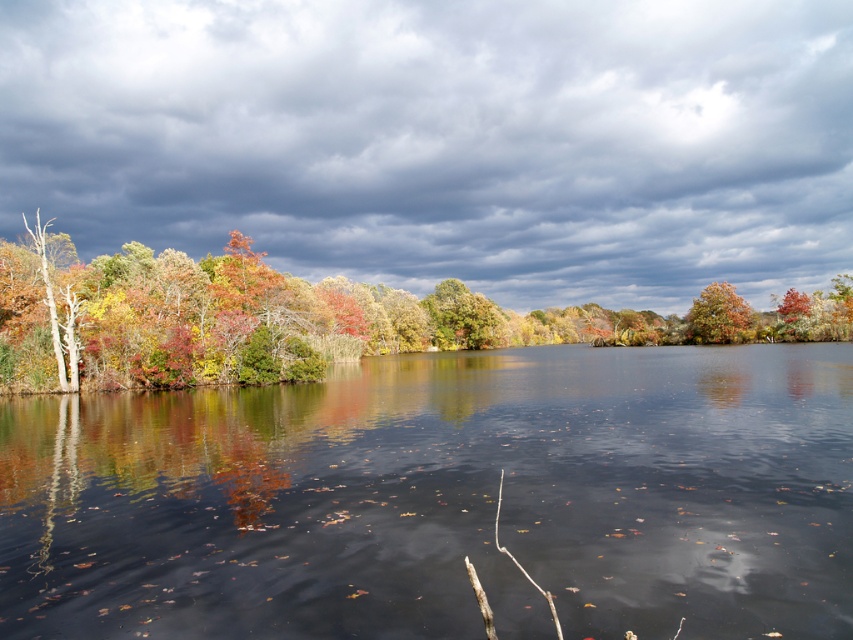
Question: Is autumn foliage at left to the right of orange matte tree at center-right from the viewer's perspective?

Choices:
 (A) yes
 (B) no

Answer: (B)

Question: Considering the real-world distances, which object is closest to the orange matte tree at center-right?

Choices:
 (A) autumn foliage at left
 (B) smooth reflective water at center
 (C) orange matte tree at upper right

Answer: (C)

Question: Among these objects, which one is nearest to the camera?

Choices:
 (A) orange matte tree at center-right
 (B) smooth reflective water at center
 (C) autumn foliage at left
 (D) cloudy gray sky at upper center

Answer: (B)

Question: Can you confirm if smooth reflective water at center is positioned to the right of autumn foliage at left?

Choices:
 (A) no
 (B) yes

Answer: (A)

Question: Which point appears farthest from the camera in this image?

Choices:
 (A) (726, 321)
 (B) (643, 202)
 (C) (782, 301)
 (D) (163, 291)

Answer: (B)

Question: Does smooth reflective water at center have a smaller size compared to orange matte tree at upper right?

Choices:
 (A) no
 (B) yes

Answer: (A)